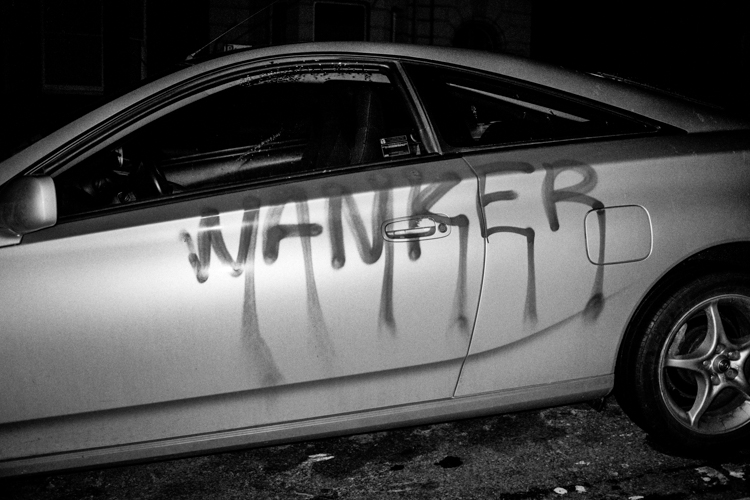
Where is `the back window`? The image size is (750, 500). the back window is located at coordinates (516, 108).